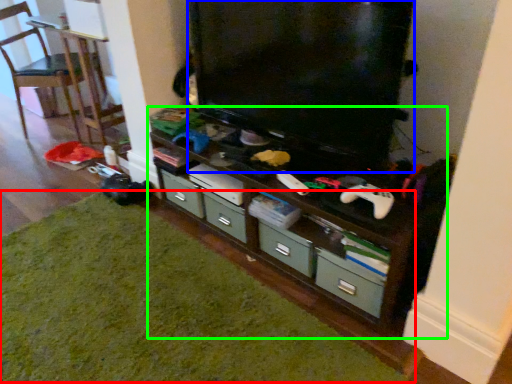
Question: Based on their relative distances, which object is nearer to hardwood (highlighted by a red box)? Choose from television (highlighted by a blue box) and shelf (highlighted by a green box).

Choices:
 (A) television
 (B) shelf

Answer: (B)